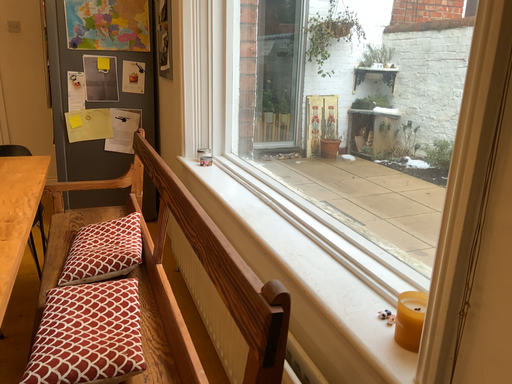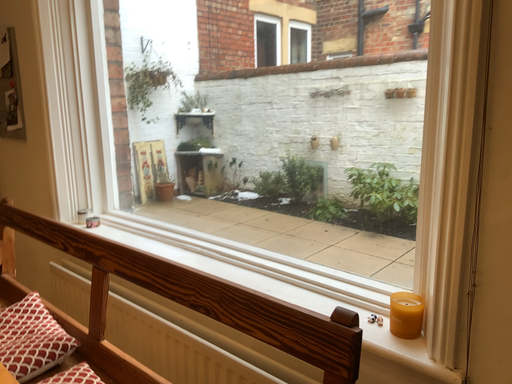
Question: Which way did the camera rotate in the video?

Choices:
 (A) rotated right
 (B) rotated left

Answer: (A)